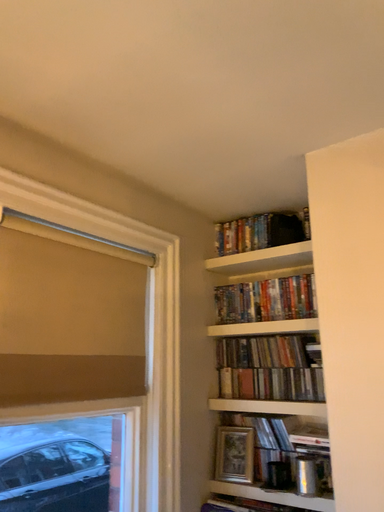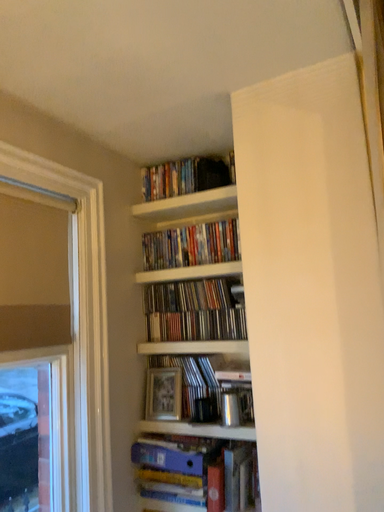
Question: Which way did the camera rotate in the video?

Choices:
 (A) rotated left
 (B) rotated right

Answer: (B)